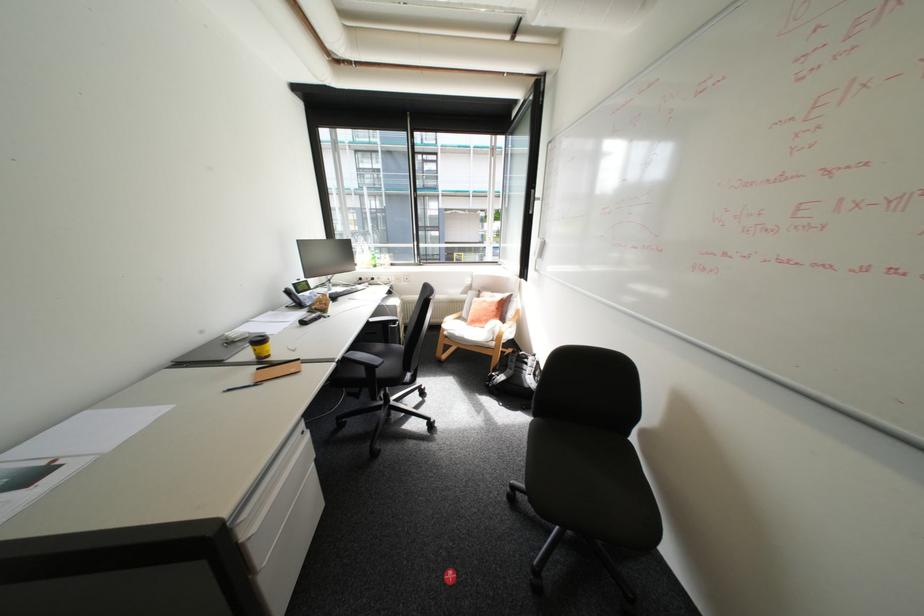
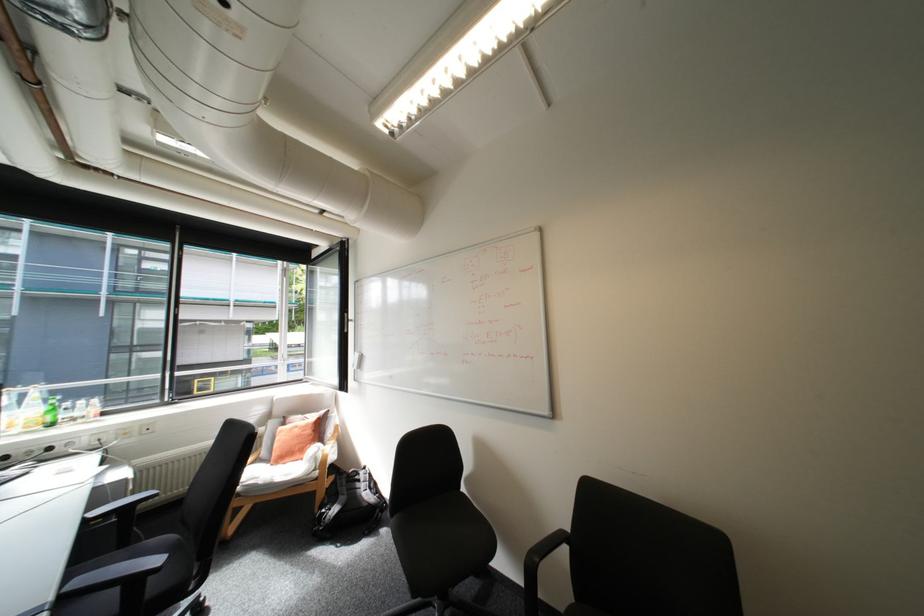
Find the pixel in the second image that matches (348,357) in the first image.

(61, 598)